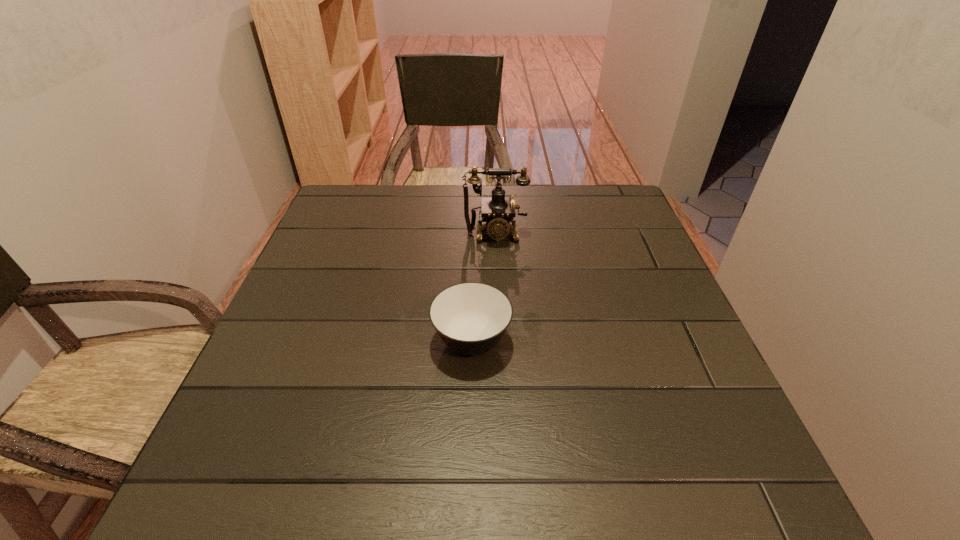
Locate an element on the screen. This screenshot has width=960, height=540. vacant space at the far right corner is located at coordinates (579, 198).

Find the location of a particular element. This screenshot has height=540, width=960. vacant space at the near right corner is located at coordinates (721, 485).